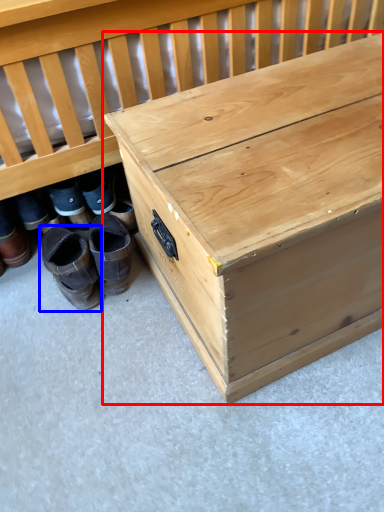
Question: Which point is closer to the camera, table (highlighted by a red box) or footwear (highlighted by a blue box)?

Choices:
 (A) table
 (B) footwear

Answer: (A)